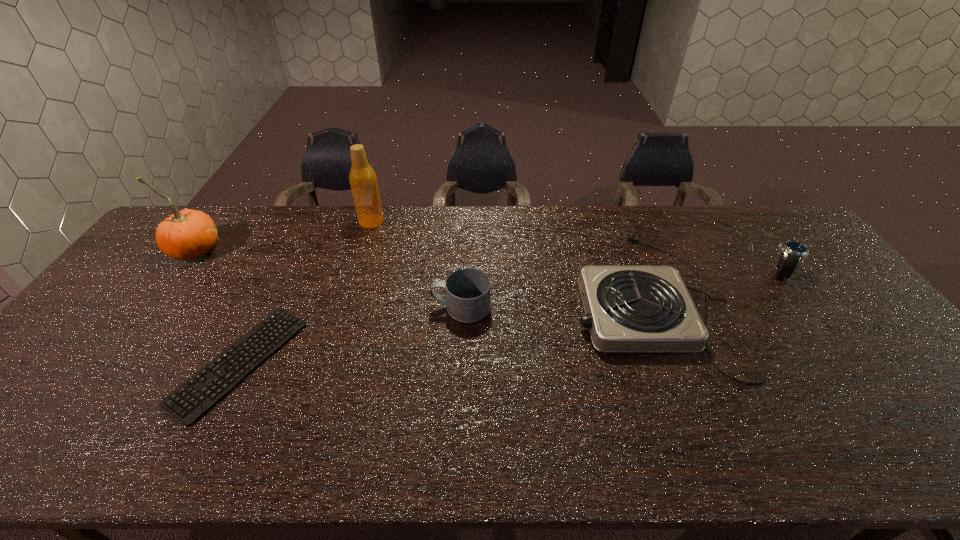
The height and width of the screenshot is (540, 960). What are the coordinates of `vacant region located 0.190m on the front of the leftmost object` in the screenshot? It's located at tap(148, 313).

You are a GUI agent. You are given a task and a screenshot of the screen. Output one action in this format:
    pyautogui.click(x=<x>, y=<y>)
    Task: Click on the free location located 0.200m on the front of the rightmost object
    The height and width of the screenshot is (540, 960).
    Given the screenshot: What is the action you would take?
    pyautogui.click(x=829, y=337)

You are a GUI agent. You are given a task and a screenshot of the screen. Output one action in this format:
    pyautogui.click(x=<x>, y=<y>)
    Task: Click on the vacant area located on the side of the mug with the handle
    
    Given the screenshot: What is the action you would take?
    pyautogui.click(x=379, y=307)

Locate an element on the screen. vacant space located on the side of the mug with the handle is located at coordinates (358, 307).

The image size is (960, 540). Find the location of `blank area located 0.330m on the side of the mug with the handle`. blank area located 0.330m on the side of the mug with the handle is located at coordinates (315, 307).

You are a GUI agent. You are given a task and a screenshot of the screen. Output one action in this format:
    pyautogui.click(x=<x>, y=<y>)
    Task: Click on the vacant space located 0.350m with a retractable cable on the side of the fifth tallest object
    
    Given the screenshot: What is the action you would take?
    pyautogui.click(x=450, y=299)

You are a GUI agent. You are given a task and a screenshot of the screen. Output one action in this format:
    pyautogui.click(x=<x>, y=<y>)
    Task: Click on the vacant space positioned with a retractable cable on the side of the fifth tallest object
    The width and height of the screenshot is (960, 540).
    Given the screenshot: What is the action you would take?
    pyautogui.click(x=523, y=299)

You are a GUI agent. You are given a task and a screenshot of the screen. Output one action in this format:
    pyautogui.click(x=<x>, y=<y>)
    Task: Click on the vacant area situated 0.140m with a retractable cable on the side of the fifth tallest object
    
    Given the screenshot: What is the action you would take?
    pyautogui.click(x=523, y=299)

The width and height of the screenshot is (960, 540). I want to click on vacant space located on the right of the shortest object, so click(x=432, y=362).

This screenshot has width=960, height=540. I want to click on beer bottle located in the far edge section of the desktop, so click(363, 180).